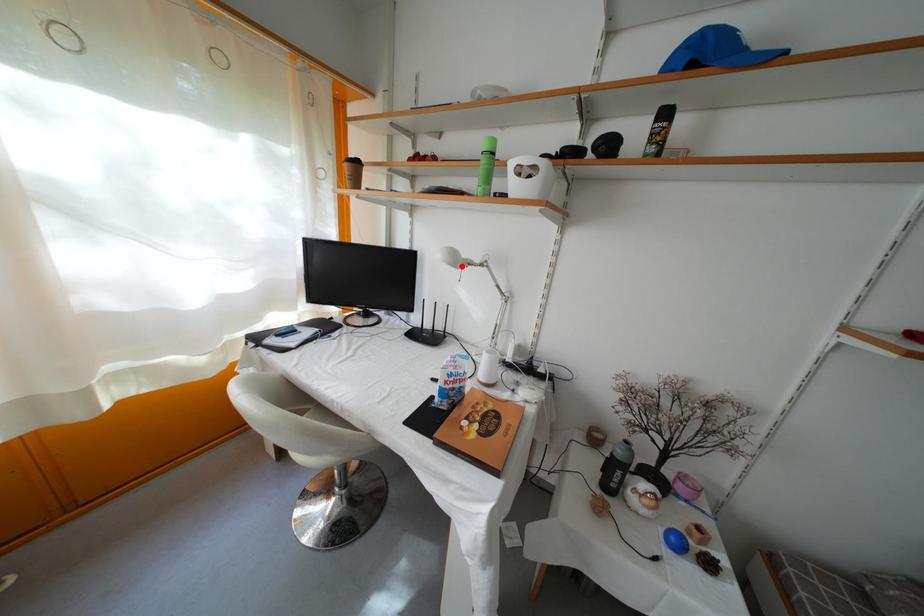
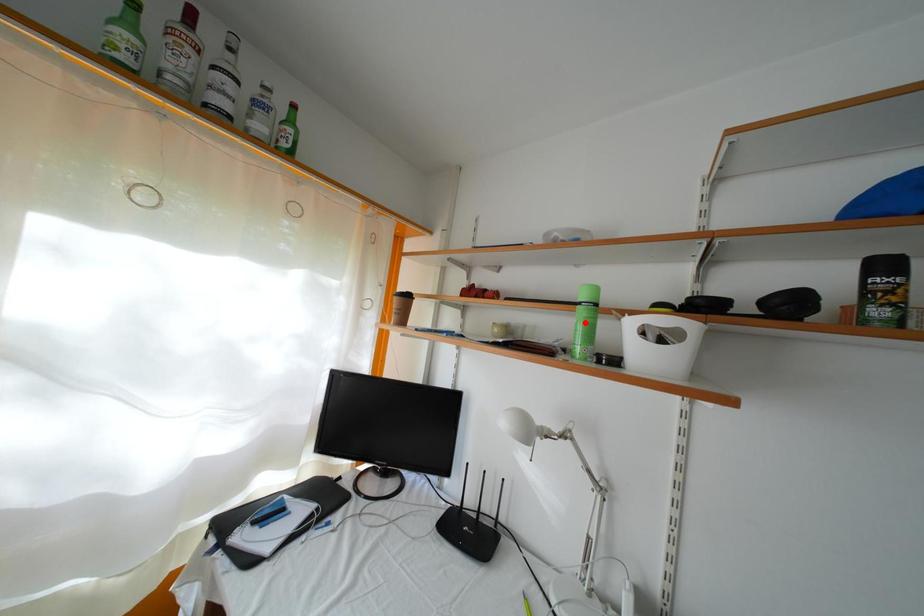
I am providing you with two images of the same scene from different viewpoints. A red point is marked on the first image and another point is marked on the second image. Do the highlighted points in image1 and image2 indicate the same real-world spot?

No